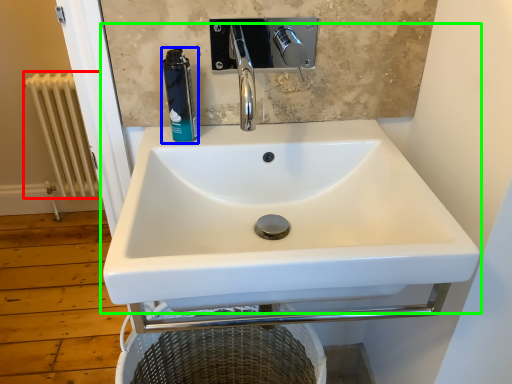
Question: Which object is positioned closest to radiator (highlighted by a red box)? Select from mouthwash (highlighted by a blue box) and sink (highlighted by a green box).

Choices:
 (A) mouthwash
 (B) sink

Answer: (A)